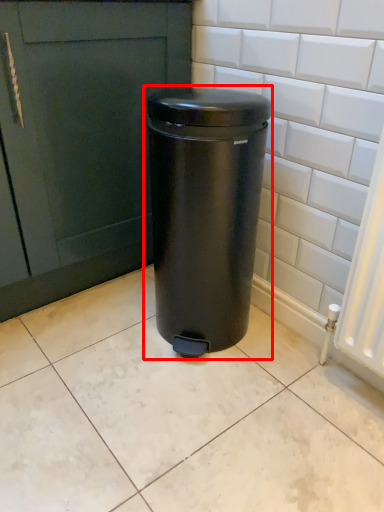
Question: Considering the relative positions of waste container (annotated by the red box) and ceramic tile in the image provided, where is waste container (annotated by the red box) located with respect to the staircase?

Choices:
 (A) left
 (B) right

Answer: (B)